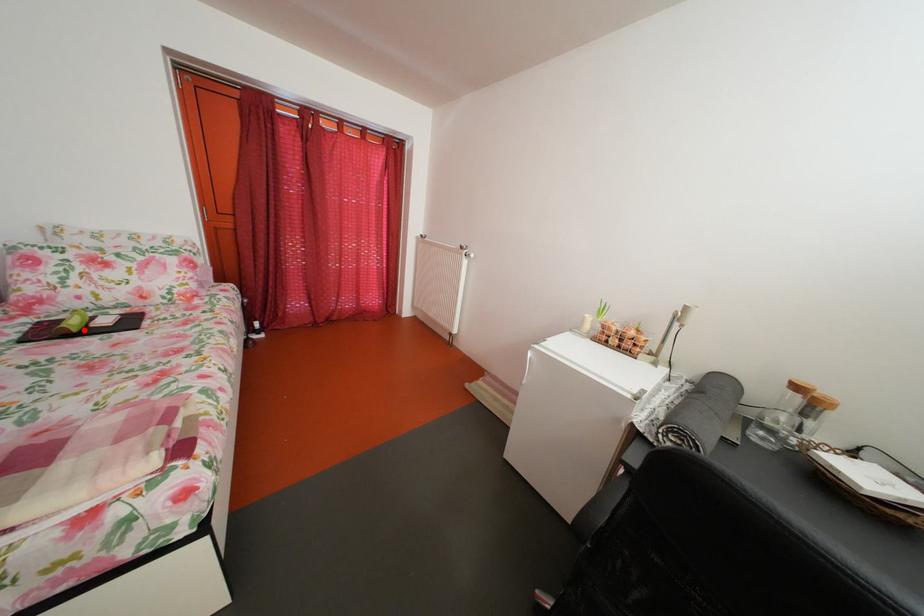
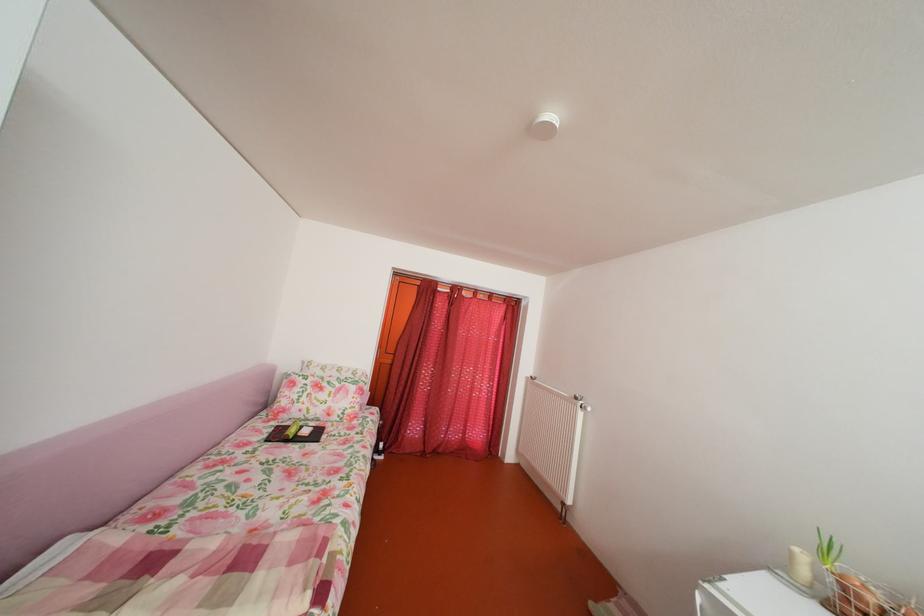
Question: I am providing you with two images of the same scene from different viewpoints. Image1 has a red point marked. In image2, the corresponding 3D location appears at what relative position? Reply with the corresponding letter.

Choices:
 (A) Closer
 (B) Farther

Answer: (B)